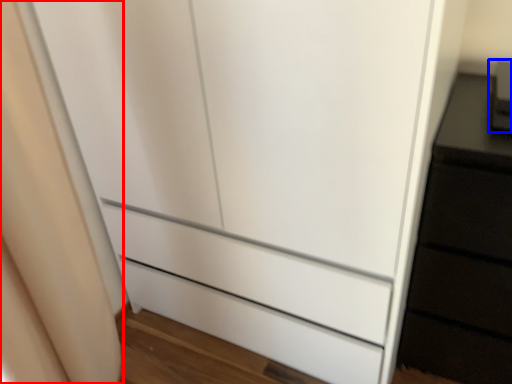
Question: Which object appears farthest to the camera in this image, curtain (highlighted by a red box) or appliance (highlighted by a blue box)?

Choices:
 (A) curtain
 (B) appliance

Answer: (B)